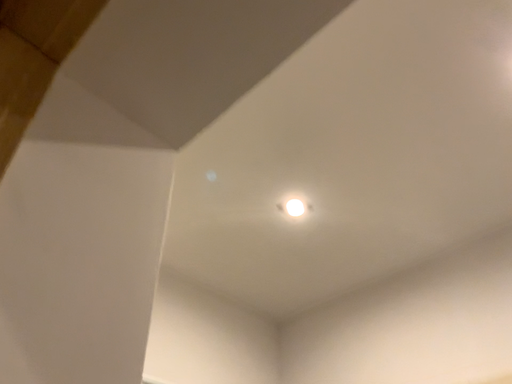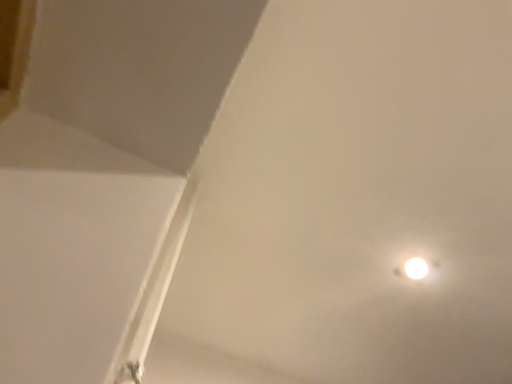
Question: How did the camera likely rotate when shooting the video?

Choices:
 (A) rotated left
 (B) rotated right

Answer: (A)